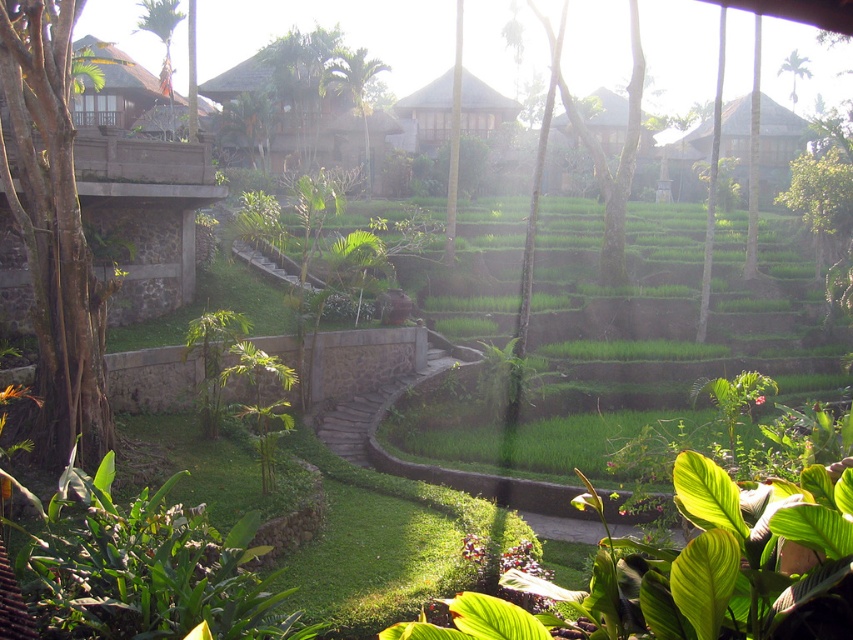
Question: Is green leafy tree at center in front of green leafy tree at upper right?

Choices:
 (A) yes
 (B) no

Answer: (A)

Question: Considering the relative positions of brown rough bark tree at left and green leafy tree at upper left in the image provided, where is brown rough bark tree at left located with respect to green leafy tree at upper left?

Choices:
 (A) left
 (B) right

Answer: (B)

Question: Among these points, which one is nearest to the camera?

Choices:
 (A) (144, 12)
 (B) (61, 156)
 (C) (782, 67)
 (D) (608, 172)

Answer: (B)

Question: Which is nearer to the green leafy tree at upper left?

Choices:
 (A) brown rough bark tree at left
 (B) green leafy tree at upper right
 (C) green leafy tree at center

Answer: (C)

Question: Which of the following is the closest to the observer?

Choices:
 (A) click(x=627, y=176)
 (B) click(x=32, y=240)
 (C) click(x=149, y=13)

Answer: (B)

Question: Does green leafy tree at upper left have a smaller size compared to green leafy tree at upper right?

Choices:
 (A) no
 (B) yes

Answer: (A)